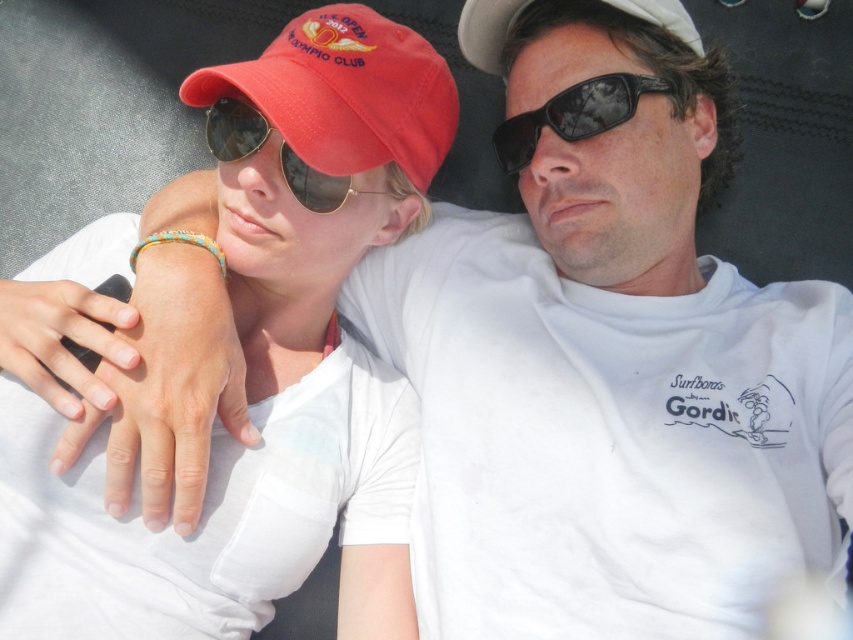
Question: Which point is closer to the camera taking this photo?

Choices:
 (A) (224, 97)
 (B) (630, 88)
 (C) (332, 104)
 (D) (364, 580)

Answer: (C)

Question: From the image, what is the correct spatial relationship of matte white t-shirt at center in relation to matte red baseball cap at upper left?

Choices:
 (A) left
 (B) right

Answer: (A)

Question: Can you confirm if matte white t-shirt at center is smaller than white fabric baseball cap at upper center?

Choices:
 (A) no
 (B) yes

Answer: (A)

Question: Which object appears closest to the camera in this image?

Choices:
 (A) matte white t-shirt at center
 (B) matte black sunglasses at upper left

Answer: (A)

Question: Estimate the real-world distances between objects in this image. Which object is closer to the black reflective sunglasses at center?

Choices:
 (A) white fabric baseball cap at upper center
 (B) matte red baseball cap at upper left
 (C) matte white t-shirt at center
 (D) matte black sunglasses at upper left

Answer: (A)

Question: Is black reflective sunglasses at center to the right of matte black sunglasses at upper left from the viewer's perspective?

Choices:
 (A) yes
 (B) no

Answer: (A)